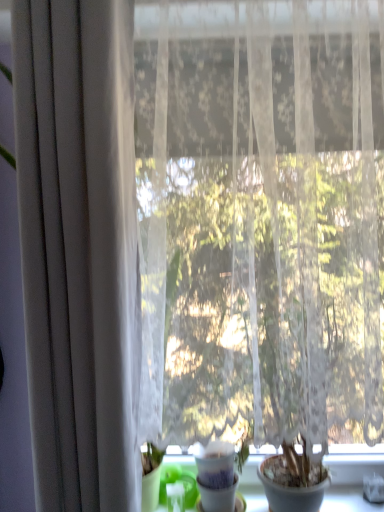
Question: Are white matte pot at center and matte gray curtain at left located far from each other?

Choices:
 (A) yes
 (B) no

Answer: (B)

Question: Does white matte pot at center have a larger size compared to matte gray curtain at left?

Choices:
 (A) no
 (B) yes

Answer: (A)

Question: Considering the relative sizes of white matte pot at center and matte gray curtain at left in the image provided, is white matte pot at center shorter than matte gray curtain at left?

Choices:
 (A) no
 (B) yes

Answer: (B)

Question: From a real-world perspective, is white matte pot at center positioned under matte gray curtain at left based on gravity?

Choices:
 (A) yes
 (B) no

Answer: (A)

Question: From a real-world perspective, is white matte pot at center on matte gray curtain at left?

Choices:
 (A) yes
 (B) no

Answer: (B)

Question: Considering their positions, is matte white flowerpot at lower right located in front of or behind white matte pot at center?

Choices:
 (A) behind
 (B) front

Answer: (B)

Question: Visually, is matte white flowerpot at lower right positioned to the left or to the right of white matte pot at center?

Choices:
 (A) left
 (B) right

Answer: (B)

Question: From a real-world perspective, is matte white flowerpot at lower right positioned above or below white matte pot at center?

Choices:
 (A) above
 (B) below

Answer: (A)

Question: Is point (286, 497) closer or farther from the camera than point (223, 503)?

Choices:
 (A) closer
 (B) farther

Answer: (A)

Question: In terms of width, does matte gray curtain at left look wider or thinner when compared to white matte pot at center?

Choices:
 (A) thin
 (B) wide

Answer: (A)

Question: Is matte gray curtain at left inside the boundaries of white matte pot at center, or outside?

Choices:
 (A) inside
 (B) outside

Answer: (B)

Question: Considering the positions of matte gray curtain at left and white matte pot at center in the image, is matte gray curtain at left bigger or smaller than white matte pot at center?

Choices:
 (A) small
 (B) big

Answer: (B)

Question: Is matte gray curtain at left taller or shorter than white matte pot at center?

Choices:
 (A) tall
 (B) short

Answer: (A)

Question: Choose the correct answer: Is green plastic at lower left inside matte white flowerpot at lower right or outside it?

Choices:
 (A) outside
 (B) inside

Answer: (A)

Question: Is point (324, 459) closer or farther from the camera than point (281, 488)?

Choices:
 (A) closer
 (B) farther

Answer: (B)